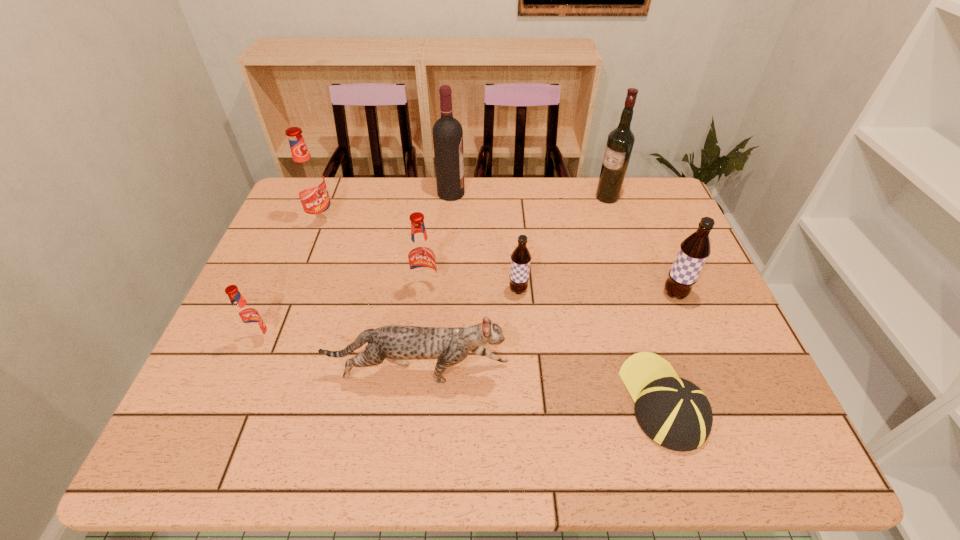
What are the coordinates of `free spot between the left wine bottle and the baseball cap` in the screenshot? It's located at (557, 297).

This screenshot has width=960, height=540. In order to click on vacant area that lies between the seventh nearest object and the left wine bottle in this screenshot , I will do `click(387, 207)`.

I want to click on free space between the bigger brown root beer and the cat, so click(546, 334).

This screenshot has width=960, height=540. I want to click on free space that is in between the farthest red root beer and the right brown root beer, so click(x=498, y=258).

At what (x,y) coordinates should I click in order to perform the action: click on vacant space that's between the cat and the baseball cap. Please return your answer as a coordinate pair (x, y). Looking at the image, I should click on (540, 387).

At what (x,y) coordinates should I click in order to perform the action: click on free space between the right brown root beer and the smaller brown root beer. Please return your answer as a coordinate pair (x, y). The height and width of the screenshot is (540, 960). Looking at the image, I should click on (596, 292).

This screenshot has width=960, height=540. Identify the location of free spot between the third root beer from left to right and the fourth object from right to left. (472, 289).

The height and width of the screenshot is (540, 960). In order to click on object that is the fourth closest to the cat in this screenshot , I will do `click(673, 412)`.

Find the location of a particular element. The width and height of the screenshot is (960, 540). the fifth closest object to the rightmost root beer is located at coordinates (422, 262).

Select which root beer appears as the fourth closest to the right brown root beer. Please provide its 2D coordinates. Your answer should be formatted as a tuple, i.e. [(x, y)], where the tuple contains the x and y coordinates of a point satisfying the conditions above.

[(246, 316)]